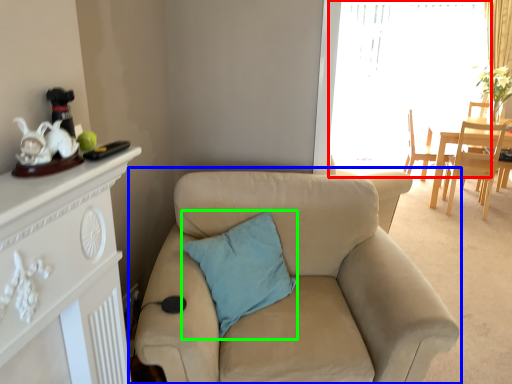
Question: Which object is positioned farthest from window screen (highlighted by a red box)? Select from studio couch (highlighted by a blue box) and pillow (highlighted by a green box).

Choices:
 (A) studio couch
 (B) pillow

Answer: (B)